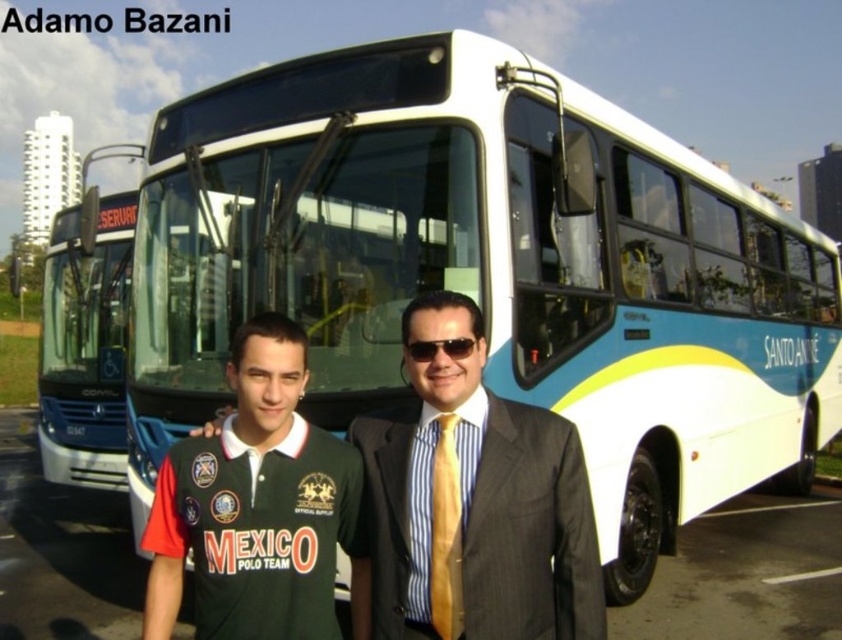
Can you confirm if dark gray pinstripe suit at center is positioned to the left of white glossy bus at center?

No, dark gray pinstripe suit at center is not to the left of white glossy bus at center.

Which is more to the left, dark gray pinstripe suit at center or white glossy bus at center?

white glossy bus at center is more to the left.

The image size is (842, 640). What do you see at coordinates (530, 531) in the screenshot?
I see `dark gray pinstripe suit at center` at bounding box center [530, 531].

Where is `dark gray pinstripe suit at center`? dark gray pinstripe suit at center is located at coordinates (530, 531).

Between white glossy bus at center and sunglasses at center, which one is positioned higher?

Positioned higher is sunglasses at center.

What are the coordinates of `white glossy bus at center` in the screenshot? It's located at (84, 346).

Where is `white glossy bus at center`? The image size is (842, 640). white glossy bus at center is located at coordinates (84, 346).

This screenshot has height=640, width=842. What do you see at coordinates (259, 508) in the screenshot?
I see `green jersey at center` at bounding box center [259, 508].

Between green jersey at center and sunglasses at center, which one appears on the left side from the viewer's perspective?

From the viewer's perspective, green jersey at center appears more on the left side.

Which is behind, point (235, 452) or point (414, 340)?

The point (235, 452) is more distant.

Identify the location of green jersey at center. (259, 508).